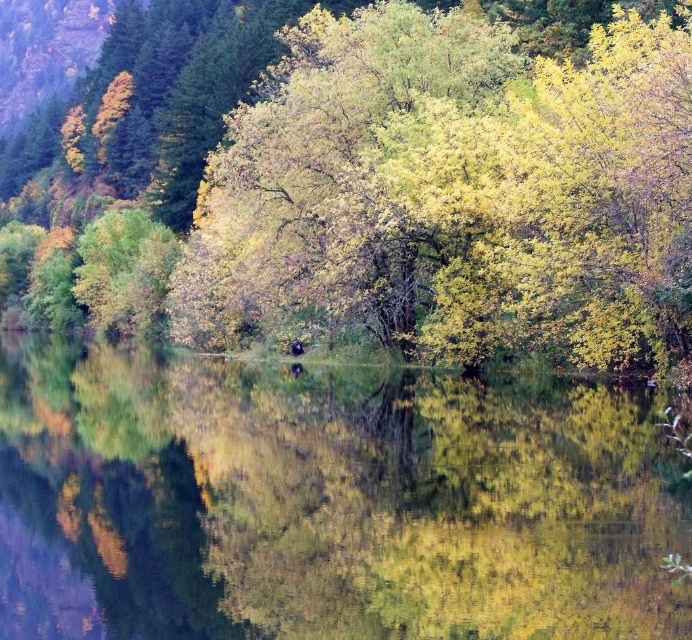
The height and width of the screenshot is (640, 692). I want to click on green reflective water at center, so click(327, 500).

Between green reflective water at center and yellow-green foliage at center, which one appears on the right side from the viewer's perspective?

Positioned to the right is green reflective water at center.

The height and width of the screenshot is (640, 692). In order to click on green reflective water at center in this screenshot , I will do `click(327, 500)`.

Locate an element on the screen. This screenshot has width=692, height=640. green reflective water at center is located at coordinates (327, 500).